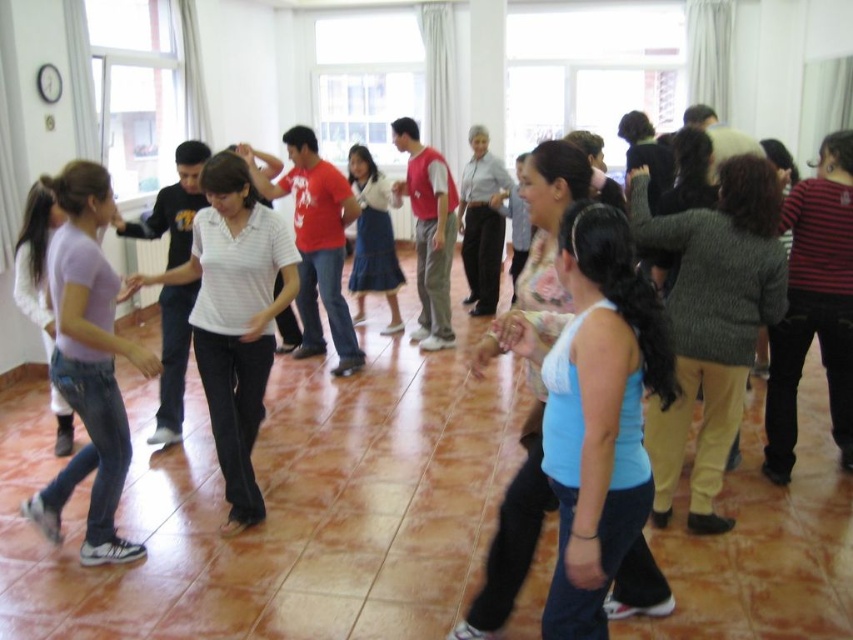
You are a photographer in the room and want to capture a photo that includes both the white matte shirt at center and the denim skirt at center. Based on their positions, which one should you focus on first to ensure both are in the frame?

The white matte shirt at center is located below the denim skirt at center, so you should focus on the denim skirt at center first to ensure both are in the frame.

In the image, there is a point at coordinates (234, 316). What object is located at this point?

The point at coordinates (234, 316) indicates the white matte shirt at center.